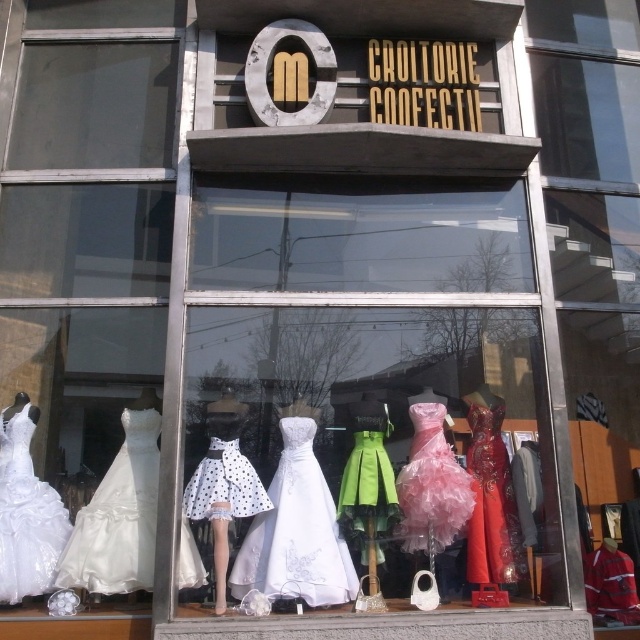
Is ivory satin dress at lower left above white polka dot skirt at center?

Incorrect, ivory satin dress at lower left is not positioned above white polka dot skirt at center.

Is ivory satin dress at lower left below white polka dot skirt at center?

Yes, ivory satin dress at lower left is below white polka dot skirt at center.

At what (x,y) coordinates should I click in order to perform the action: click on ivory satin dress at lower left. Please return your answer as a coordinate pair (x, y). Looking at the image, I should click on (118, 516).

Who is higher up, pink satin dress at center or white polka dot fabric dress at center?

white polka dot fabric dress at center is higher up.

Which is below, pink satin dress at center or white polka dot fabric dress at center?

pink satin dress at center

Which is behind, point (420, 541) or point (218, 449)?

Positioned behind is point (420, 541).

Identify the location of pink satin dress at center. This screenshot has width=640, height=640. (432, 484).

From the picture: Can you confirm if white satin dress at center is smaller than pink satin dress at center?

No, white satin dress at center is not smaller than pink satin dress at center.

Is white satin dress at center in front of pink satin dress at center?

Yes.

This screenshot has width=640, height=640. I want to click on white satin dress at center, so (296, 531).